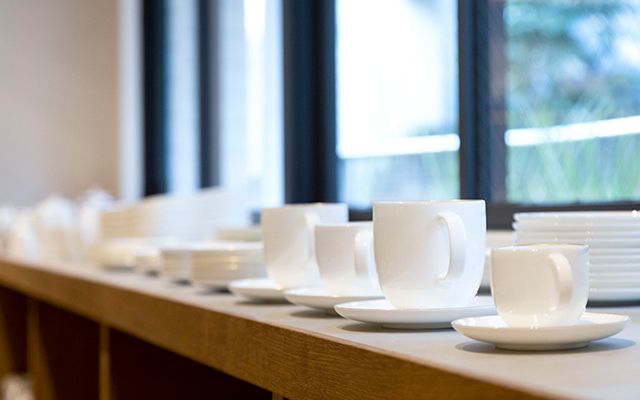
Find the location of `cup handles`. cup handles is located at coordinates (310, 220), (363, 263), (459, 254), (562, 276).